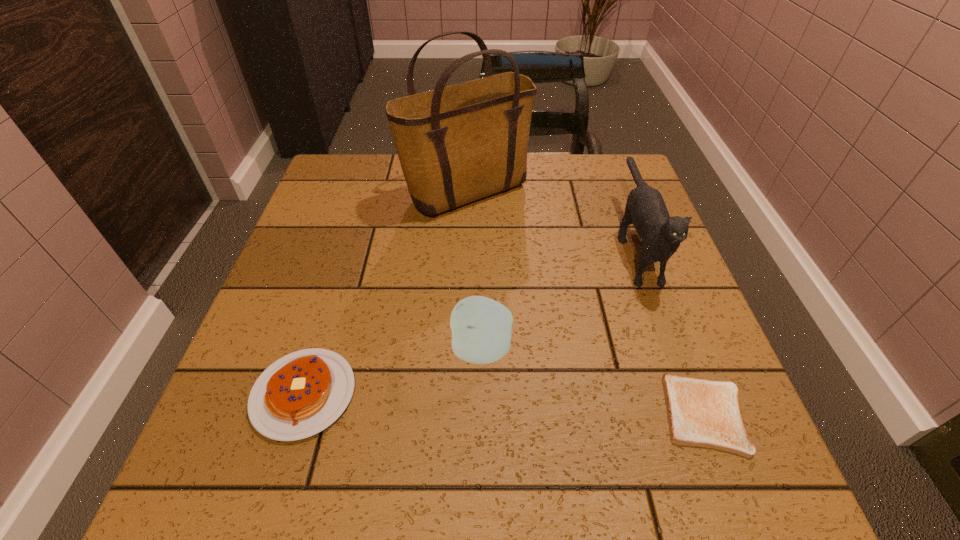
What are the coordinates of `free space between the cat and the toast` in the screenshot? It's located at (669, 329).

You are a GUI agent. You are given a task and a screenshot of the screen. Output one action in this format:
    pyautogui.click(x=<x>, y=<y>)
    Task: Click on the empty location between the apple and the fourth tallest object
    The image size is (960, 540).
    Given the screenshot: What is the action you would take?
    pyautogui.click(x=393, y=372)

Identify the location of vacant area that lies between the tote bag and the shortest object. (586, 305).

Locate an element on the screen. The image size is (960, 540). free space between the third tallest object and the shortest object is located at coordinates 593,382.

Where is `free space that is in between the apple and the fourth shortest object`? The height and width of the screenshot is (540, 960). free space that is in between the apple and the fourth shortest object is located at coordinates (558, 296).

At what (x,y) coordinates should I click in order to perform the action: click on vacant region between the fourth tallest object and the shortest object. Please return your answer as a coordinate pair (x, y). The width and height of the screenshot is (960, 540). Looking at the image, I should click on (504, 404).

At what (x,y) coordinates should I click in order to perform the action: click on object that can be found as the third closest to the leftmost object. Please return your answer as a coordinate pair (x, y). Looking at the image, I should click on (705, 413).

Select which object is the fourth closest to the pancake. Please provide its 2D coordinates. Your answer should be formatted as a tuple, i.e. [(x, y)], where the tuple contains the x and y coordinates of a point satisfying the conditions above.

[(661, 235)]

You are a GUI agent. You are given a task and a screenshot of the screen. Output one action in this format:
    pyautogui.click(x=<x>, y=<y>)
    Task: Click on the free spot that satisfies the following two spatial constraints: 1. on the front-facing side of the fourth shortest object; 2. on the right side of the toast
    The image size is (960, 540).
    Given the screenshot: What is the action you would take?
    pyautogui.click(x=697, y=414)

Locate an element on the screen. Image resolution: width=960 pixels, height=540 pixels. free space in the image that satisfies the following two spatial constraints: 1. on the front-facing side of the cat; 2. on the right side of the toast is located at coordinates (697, 414).